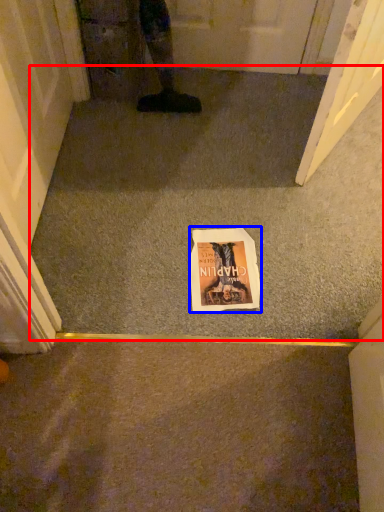
Question: Which object appears farthest to the camera in this image, concrete (highlighted by a red box) or comic book (highlighted by a blue box)?

Choices:
 (A) concrete
 (B) comic book

Answer: (B)